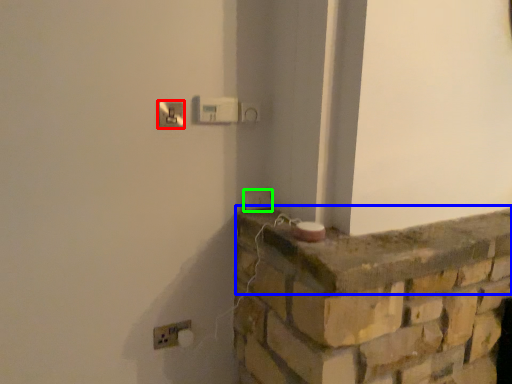
Question: Which object is the farthest from light switch (highlighted by a red box)? Choose among these: ledge (highlighted by a blue box) or light switch (highlighted by a green box).

Choices:
 (A) ledge
 (B) light switch

Answer: (A)